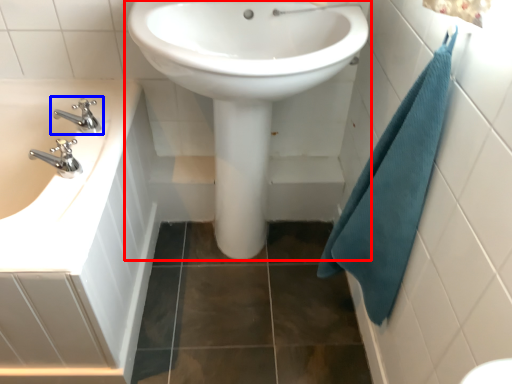
Question: Which of the following is the closest to the observer, sink (highlighted by a red box) or tap (highlighted by a blue box)?

Choices:
 (A) sink
 (B) tap

Answer: (A)